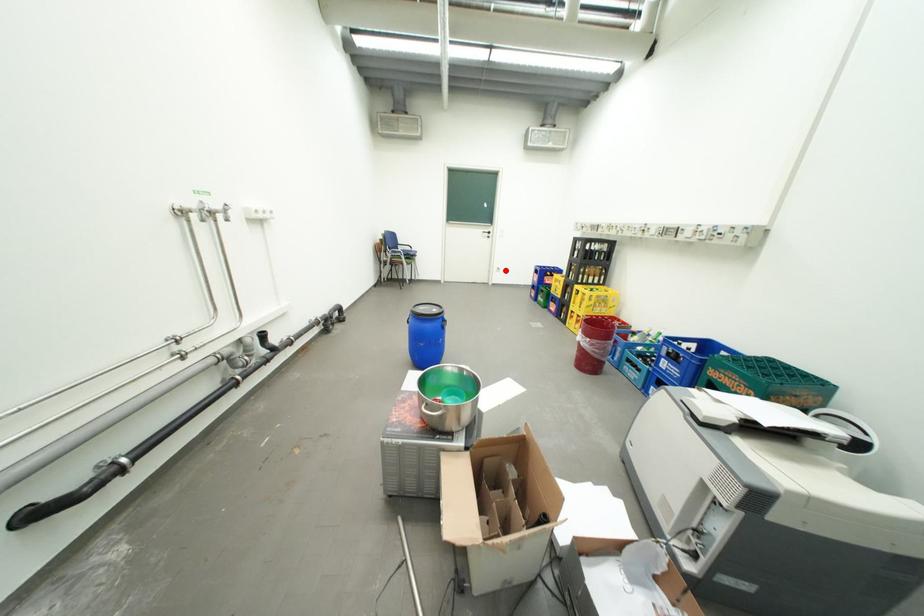
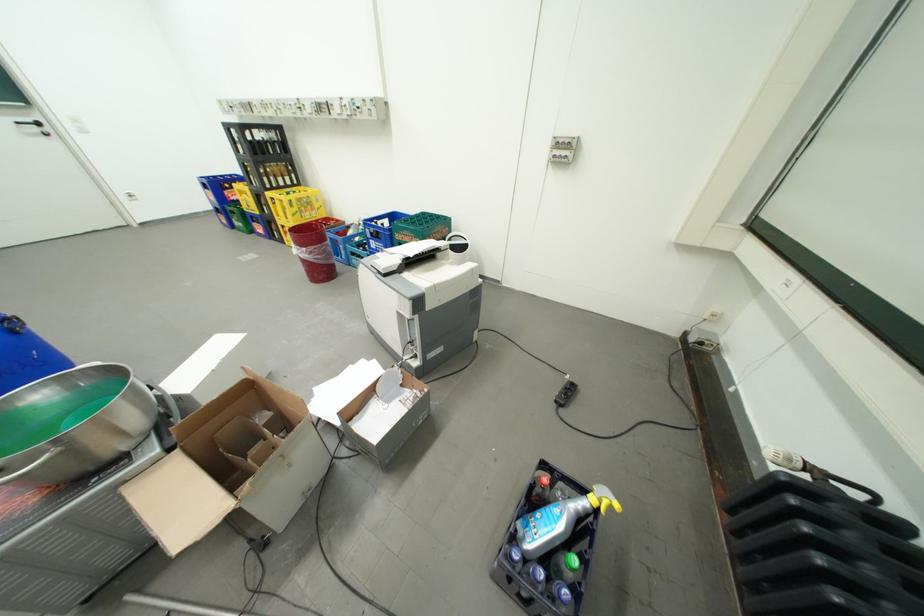
Question: I am providing you with two images of the same scene from different viewpoints. Given a red point in image1, look at the same physical point in image2. Is it:

Choices:
 (A) Closer to the viewpoint
 (B) Farther from the viewpoint

Answer: (B)